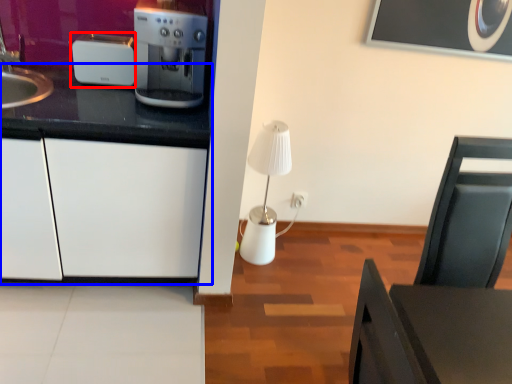
Question: Among these objects, which one is nearest to the camera, kitchen appliance (highlighted by a red box) or cabinetry (highlighted by a blue box)?

Choices:
 (A) kitchen appliance
 (B) cabinetry

Answer: (B)